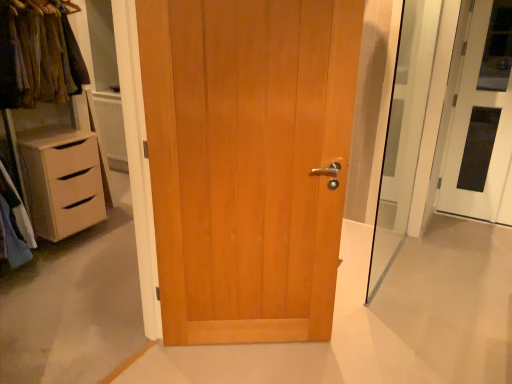
Locate an element on the screen. spots to the right of light brown wood door at center, the first door when ordered from front to back is located at coordinates (353, 352).